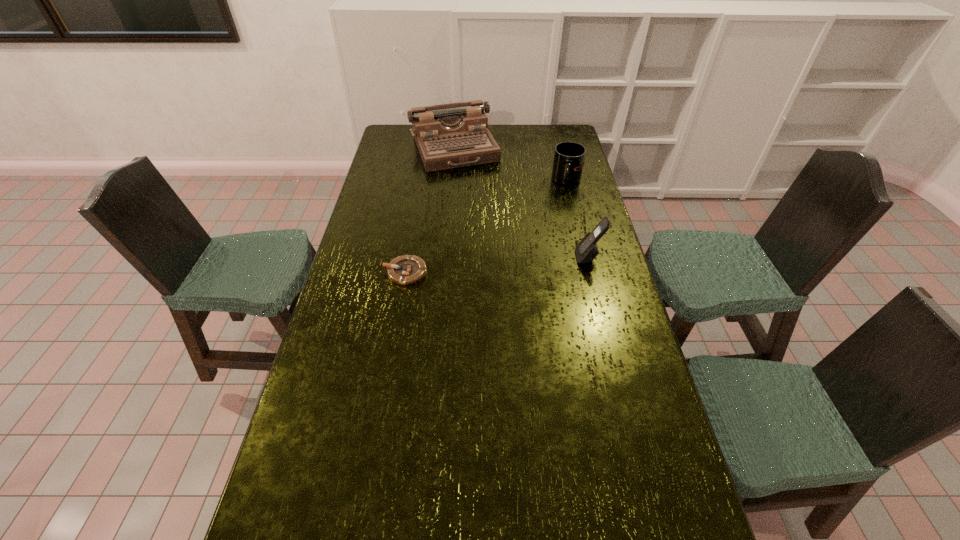
Where is `vacant space on the desktop that is between the shortest object and the cellular telephone and is positioned with the handle on the side of the third tallest object`? Image resolution: width=960 pixels, height=540 pixels. vacant space on the desktop that is between the shortest object and the cellular telephone and is positioned with the handle on the side of the third tallest object is located at coordinates (516, 263).

Locate an element on the screen. free spot on the desktop that is between the ashtray and the third shortest object and is positioned on the keyboard of the typewriter is located at coordinates pos(508,264).